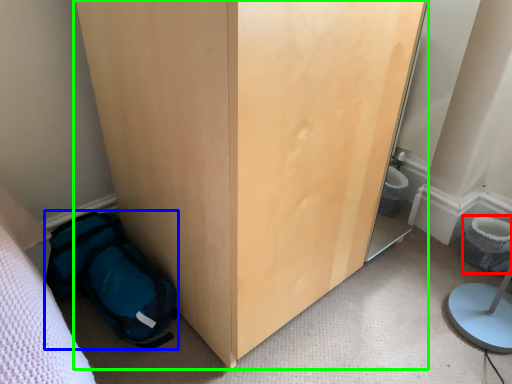
Question: Which object is positioned farthest from toilet bowl (highlighted by a red box)? Select from backpack (highlighted by a blue box) and furniture (highlighted by a green box).

Choices:
 (A) backpack
 (B) furniture

Answer: (A)